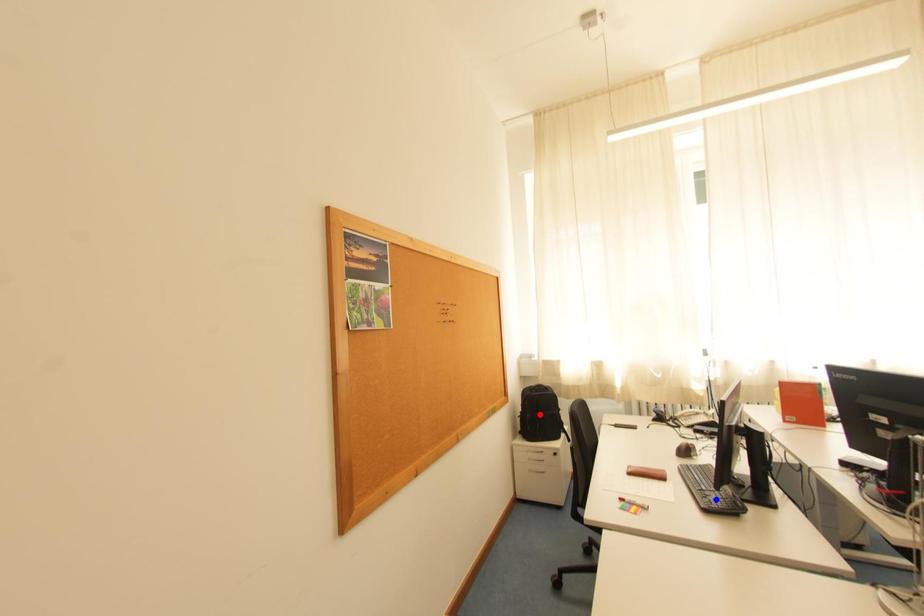
Question: In the image, two points are highlighted. Which point is nearer to the camera? Reply with the corresponding letter.

Choices:
 (A) blue point
 (B) red point

Answer: (A)